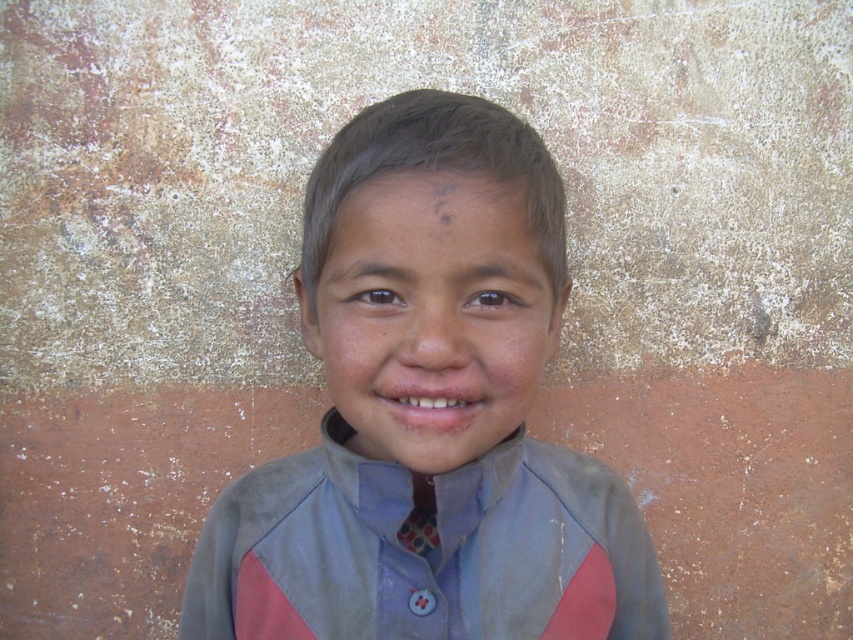
You are a fashion designer examining a child wearing a matte gray shirt at center and a gray cotton jacket at center. Which piece of clothing has a narrower width?

The matte gray shirt at center has a lesser width compared to the gray cotton jacket at center, so the matte gray shirt at center is narrower.

You are taking a photo of the child in the scene and want to focus on the point at the collar button located at point (448,422) and the point at the shirt near the neckline at point (433,536). Which point is closer to the camera?

Point (448,422) is closer to the camera than point (433,536).